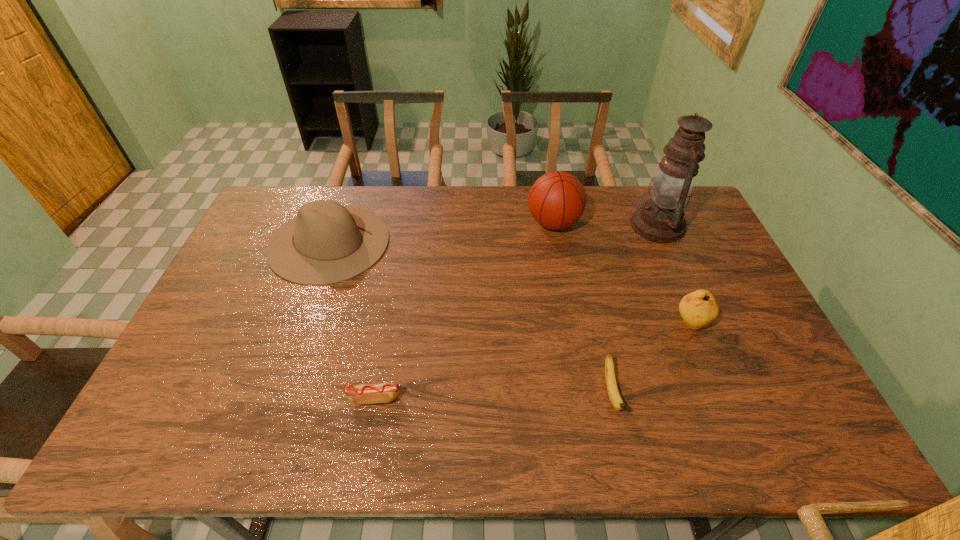
Where is `object positioned at the far right corner`? This screenshot has height=540, width=960. object positioned at the far right corner is located at coordinates (661, 219).

Identify the location of free region at the far edge of the desktop. (430, 191).

This screenshot has width=960, height=540. In the image, there is a desktop. What are the coordinates of `vacant space at the near edge` in the screenshot? It's located at (211, 451).

Locate an element on the screen. The width and height of the screenshot is (960, 540). blank area at the left edge is located at coordinates (239, 270).

Where is `vacant space at the right edge of the desktop`? This screenshot has width=960, height=540. vacant space at the right edge of the desktop is located at coordinates (719, 299).

Where is `blank region between the sombrero and the basketball`? blank region between the sombrero and the basketball is located at coordinates (442, 233).

The height and width of the screenshot is (540, 960). Identify the location of free point between the second tallest object and the sausage. (464, 311).

Locate an element on the screen. The width and height of the screenshot is (960, 540). free point between the sombrero and the pear is located at coordinates (510, 283).

The width and height of the screenshot is (960, 540). I want to click on blank region between the sombrero and the shortest object, so click(351, 320).

I want to click on empty space that is in between the oil lamp and the fourth farthest object, so click(x=674, y=274).